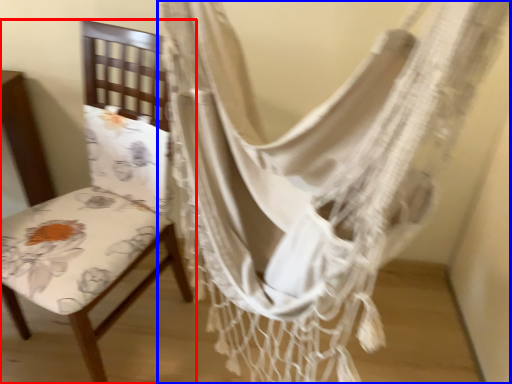
Question: Which object appears farthest to the camera in this image, chair (highlighted by a red box) or curtain (highlighted by a blue box)?

Choices:
 (A) chair
 (B) curtain

Answer: (A)